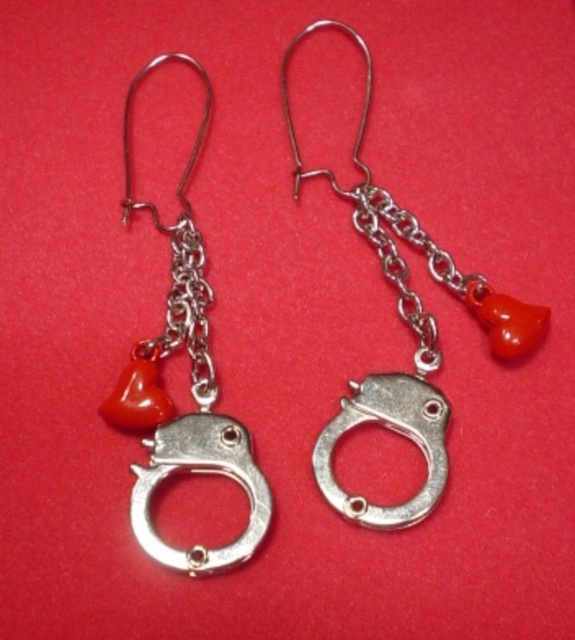
Question: Does silver metallic handcuff at center have a smaller size compared to silver metallic handcuff at left?

Choices:
 (A) no
 (B) yes

Answer: (A)

Question: Among these points, which one is farthest from the camera?

Choices:
 (A) click(270, 496)
 (B) click(417, 428)

Answer: (B)

Question: Is silver metallic handcuff at center smaller than silver metallic handcuff at left?

Choices:
 (A) no
 (B) yes

Answer: (A)

Question: Does silver metallic handcuff at center have a larger size compared to silver metallic handcuff at left?

Choices:
 (A) yes
 (B) no

Answer: (A)

Question: Among these objects, which one is nearest to the camera?

Choices:
 (A) silver metallic handcuff at center
 (B) silver metallic handcuff at left

Answer: (B)